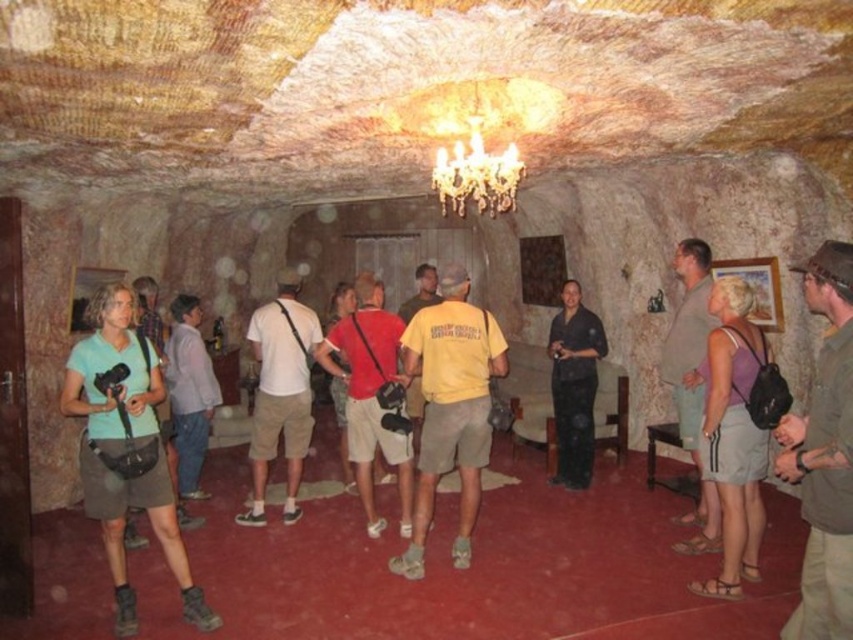
Question: Is brown leather hat at upper right bigger than yellow cotton shirt at center?

Choices:
 (A) yes
 (B) no

Answer: (B)

Question: Observing the image, what is the correct spatial positioning of purple fabric tank top at center in reference to matte red shirt at center?

Choices:
 (A) above
 (B) below

Answer: (B)

Question: Where is brown leather hat at upper right located in relation to yellow cotton shirt at center in the image?

Choices:
 (A) above
 (B) below

Answer: (A)

Question: Which of the following is the farthest from the observer?

Choices:
 (A) (468, 378)
 (B) (761, 436)
 (C) (351, 358)
 (D) (844, 378)

Answer: (C)

Question: Among these objects, which one is nearest to the camera?

Choices:
 (A) brown leather hat at upper right
 (B) matte red shirt at center

Answer: (A)

Question: Which of the following is the farthest from the observer?

Choices:
 (A) (151, 461)
 (B) (712, 385)
 (C) (363, 387)

Answer: (C)